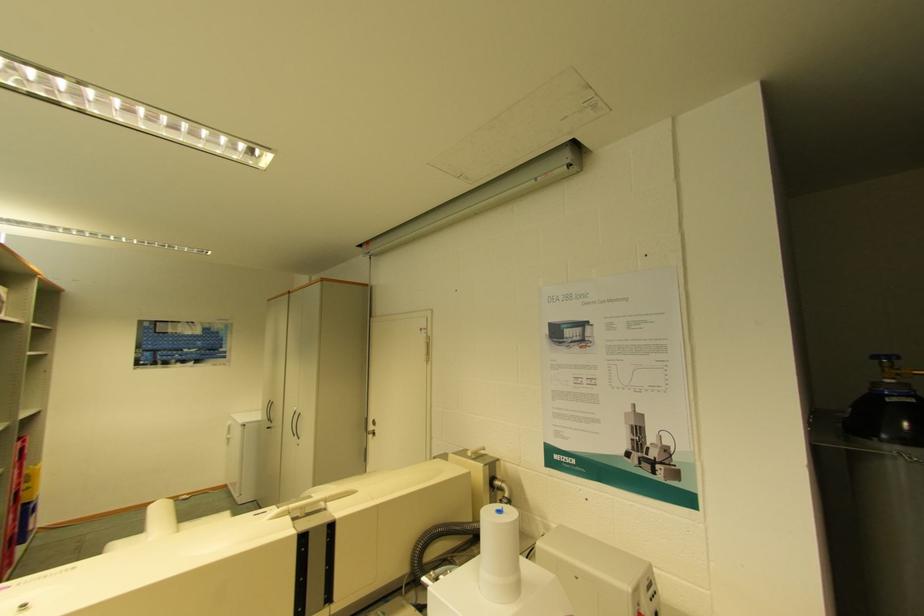
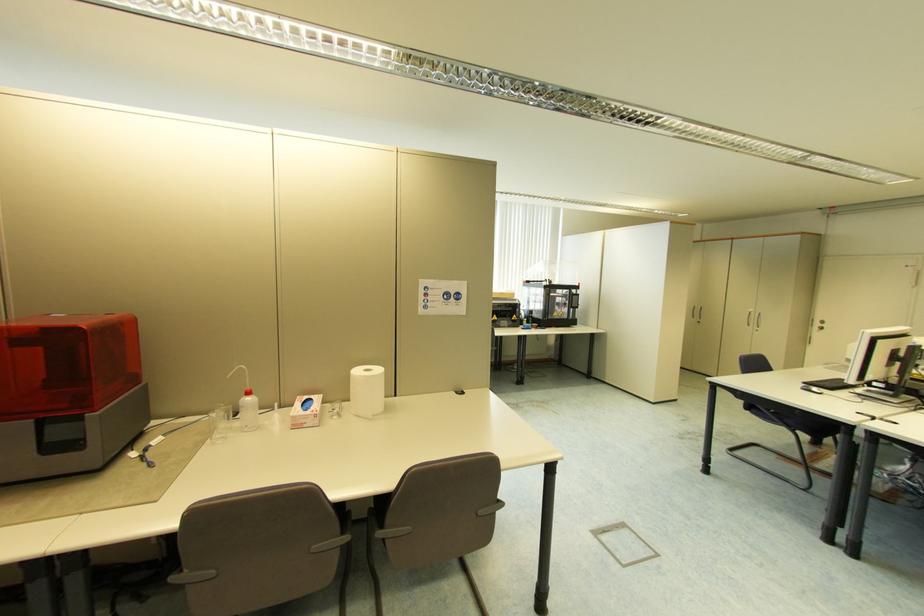
Where in the second image is the point corresponding to pixel 374 427 from the first image?

(821, 325)